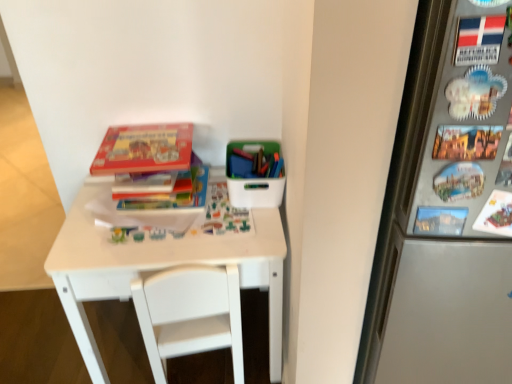
You are a GUI agent. You are given a task and a screenshot of the screen. Output one action in this format:
    pyautogui.click(x=<x>, y=<y>)
    Task: Click on the vacant area on top of white plastic chair at center (from a real-world perspective)
    Image resolution: width=512 pixels, height=384 pixels.
    Given the screenshot: What is the action you would take?
    coord(177,232)